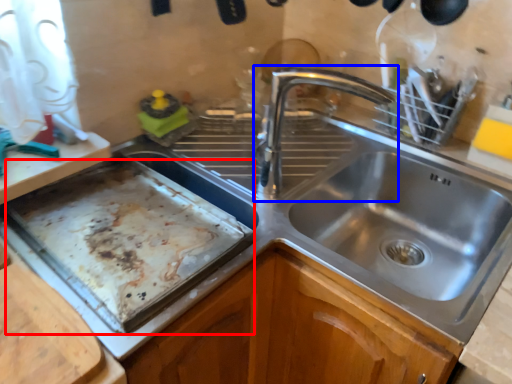
Question: Among these objects, which one is farthest to the camera, baking sheet (highlighted by a red box) or tap (highlighted by a blue box)?

Choices:
 (A) baking sheet
 (B) tap

Answer: (B)